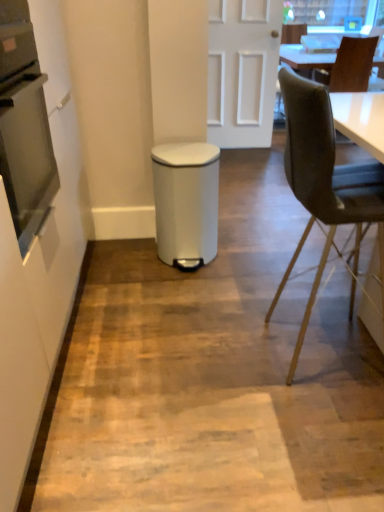
Question: Is point pos(34,125) closer or farther from the camera than point pos(203,200)?

Choices:
 (A) closer
 (B) farther

Answer: (B)

Question: Considering the positions of stainless steel oven at left and white plastic waste bin at center in the image, is stainless steel oven at left bigger or smaller than white plastic waste bin at center?

Choices:
 (A) small
 (B) big

Answer: (B)

Question: Estimate the real-world distances between objects in this image. Which object is closer to the velvet black chair at right, arranged as the 2th chair when viewed from the back?

Choices:
 (A) white plastic waste bin at center
 (B) stainless steel oven at left
 (C) white matte trash can at center
 (D) white matte door at center
 (E) brown leather chair at upper right, acting as the 1th chair starting from the back

Answer: (A)

Question: Based on their relative distances, which object is nearer to the white matte door at center?

Choices:
 (A) white plastic waste bin at center
 (B) brown leather chair at upper right, which is the first chair from right to left
 (C) stainless steel oven at left
 (D) velvet black chair at right, positioned as the first chair in bottom-to-top order
 (E) white matte trash can at center

Answer: (B)